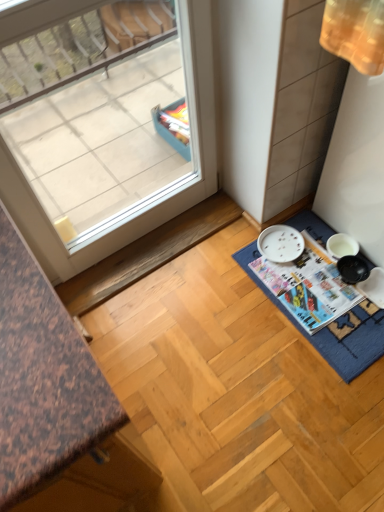
At what (x,y) coordinates should I click in order to perform the action: click on vacant point above white glossy magazine at lower right (from a real-world perspective). Please return your answer as a coordinate pair (x, y). Image resolution: width=384 pixels, height=512 pixels. Looking at the image, I should click on (310, 272).